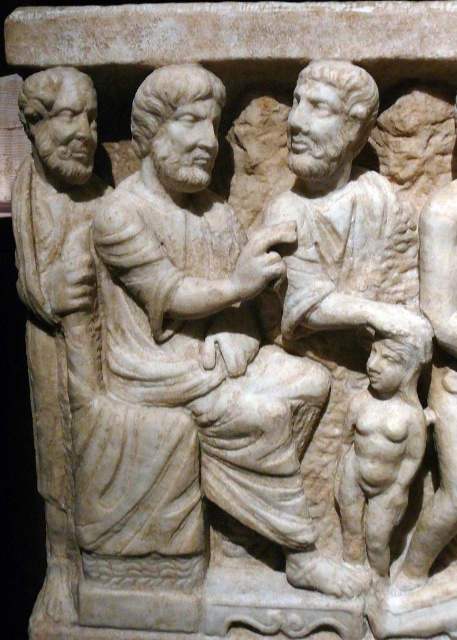
You are an art conservator examining the relief sculpture. You need to clean the white marble child at right and the white marble child at lower right. Which child is closer to you and should be cleaned first to avoid damaging the one behind?

The white marble child at right is in front of the white marble child at lower right, so you should clean the white marble child at right first to avoid damaging the one behind.

You are an art conservator examining the marble relief sculpture. You notice two points on the sculpture labeled as point 1 at coordinates [352,500] and point 2 at coordinates [366,433]. Which point is closer to your current position as you examine the sculpture?

Point 1 at coordinates [352,500] is closer to your current position because it is further to the viewer than point 2 at coordinates [366,433], which is positioned further away.